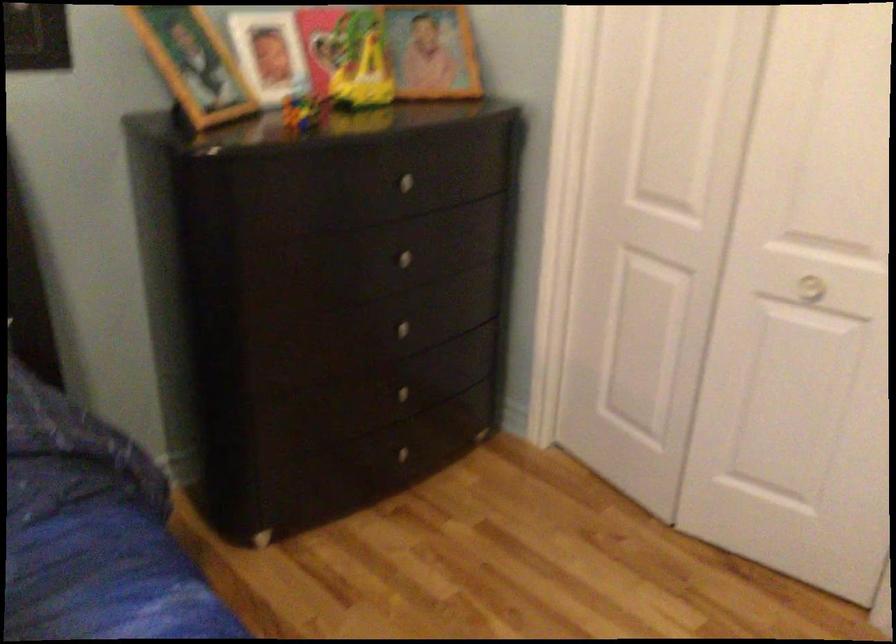
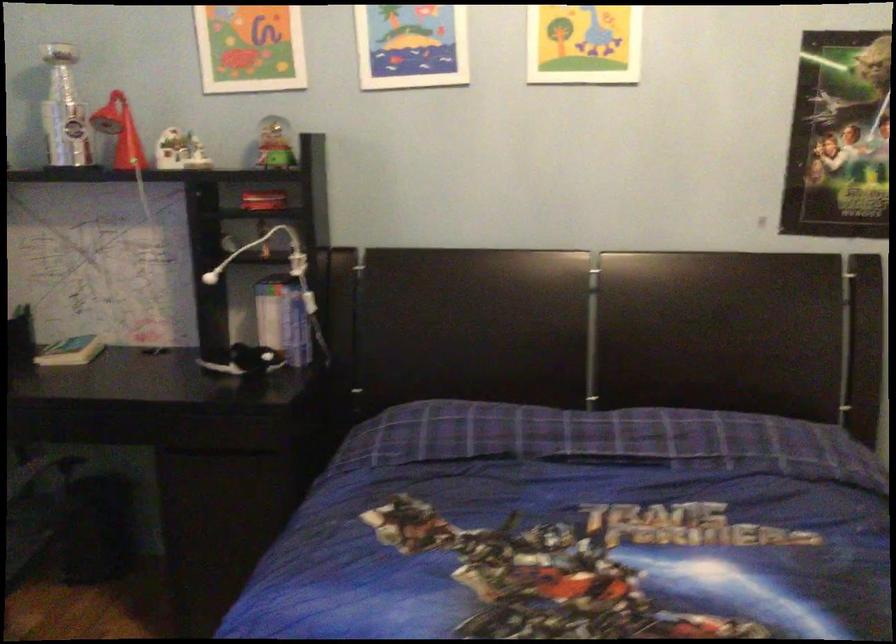
Question: How did the camera likely rotate?

Choices:
 (A) Left
 (B) Right
 (C) Up
 (D) Down

Answer: (A)